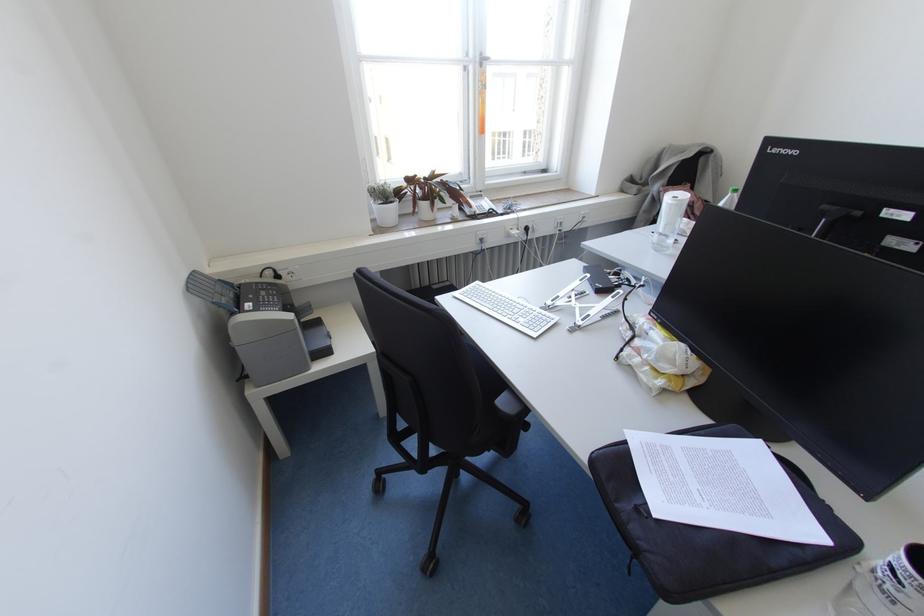
Locate an element on the screen. window handle is located at coordinates (481, 61).